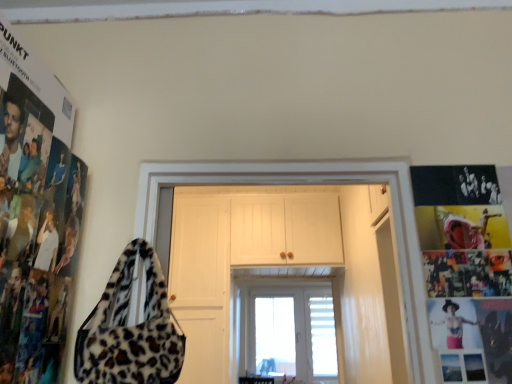
This screenshot has height=384, width=512. Describe the element at coordinates (453, 324) in the screenshot. I see `leather-like red pants at lower right` at that location.

Locate an element on the screen. The height and width of the screenshot is (384, 512). white wooden door at center is located at coordinates click(x=307, y=183).

This screenshot has width=512, height=384. Identify the location of black matte poster at right. (466, 270).

Can you confirm if leopard print fabric shoulder bag at left is wider than leather-like red pants at lower right?

Yes, leopard print fabric shoulder bag at left is wider than leather-like red pants at lower right.

Does point (113, 378) lie in front of point (464, 305)?

Yes.

Which is more to the right, leopard print fabric shoulder bag at left or leather-like red pants at lower right?

Positioned to the right is leather-like red pants at lower right.

From a real-world perspective, is transparent glass door at center physically above leopard print fabric shoulder bag at left?

No.

Is transparent glass door at center wider or thinner than leopard print fabric shoulder bag at left?

In the image, transparent glass door at center appears to be wider than leopard print fabric shoulder bag at left.

Is transparent glass door at center far away from leopard print fabric shoulder bag at left?

Yes, transparent glass door at center is far from leopard print fabric shoulder bag at left.

Does point (303, 331) come farther from viewer compared to point (97, 360)?

Yes, it is.

Considering the relative positions of leopard print fabric shoulder bag at left and transparent glass door at center in the image provided, is leopard print fabric shoulder bag at left behind transparent glass door at center?

No, leopard print fabric shoulder bag at left is closer to the camera.

From the image's perspective, is leopard print fabric shoulder bag at left located beneath transparent glass door at center?

No, from the image's perspective, leopard print fabric shoulder bag at left is not beneath transparent glass door at center.

Considering the sizes of leopard print fabric shoulder bag at left and transparent glass door at center in the image, is leopard print fabric shoulder bag at left taller or shorter than transparent glass door at center?

leopard print fabric shoulder bag at left is shorter than transparent glass door at center.

From the picture: Which of these two, leopard print fabric shoulder bag at left or transparent glass door at center, is wider?

Wider between the two is transparent glass door at center.

Between transparent glass door at center and leather-like red pants at lower right, which one has less height?

leather-like red pants at lower right is shorter.

Locate an element on the screen. The height and width of the screenshot is (384, 512). window behind the leather-like red pants at lower right is located at coordinates (286, 330).

Is transparent glass door at center surrounding leather-like red pants at lower right?

No, leather-like red pants at lower right is not surrounded by transparent glass door at center.

From the image's perspective, which one is positioned higher, transparent glass door at center or leather-like red pants at lower right?

leather-like red pants at lower right is shown above in the image.

Are transparent glass door at center and black matte poster at right located far from each other?

transparent glass door at center is positioned a significant distance from black matte poster at right.

From the image's perspective, which one is positioned higher, transparent glass door at center or black matte poster at right?

From the image's view, black matte poster at right is above.

Does transparent glass door at center come behind black matte poster at right?

Yes, transparent glass door at center is behind black matte poster at right.

Is leather-like red pants at lower right positioned with its back to leopard print fabric shoulder bag at left?

That's not correct — leather-like red pants at lower right is not looking away from leopard print fabric shoulder bag at left.

Which object is more forward, leather-like red pants at lower right or leopard print fabric shoulder bag at left?

leopard print fabric shoulder bag at left is in front.

From a real-world perspective, relative to white wooden door at center, is leopard print fabric shoulder bag at left vertically above or below?

leopard print fabric shoulder bag at left is situated lower than white wooden door at center in the real world.

From the image's perspective, is leopard print fabric shoulder bag at left located above or below white wooden door at center?

Based on their image positions, leopard print fabric shoulder bag at left is located above white wooden door at center.

Is leopard print fabric shoulder bag at left facing towards white wooden door at center?

No.

Considering the points (156, 320) and (402, 290), which point is behind, point (156, 320) or point (402, 290)?

The point (402, 290) is behind.

Locate an element on the screen. This screenshot has width=512, height=384. person on the right side of leopard print fabric shoulder bag at left is located at coordinates (453, 324).

This screenshot has width=512, height=384. Find the location of `shoulder bag on the left side of transparent glass door at center`. shoulder bag on the left side of transparent glass door at center is located at coordinates (130, 329).

Estimate the real-world distances between objects in this image. Which object is closer to leopard print fabric shoulder bag at left, black matte poster at right or white wooden door at center?

white wooden door at center lies closer to leopard print fabric shoulder bag at left than the other object.

Looking at the image, which one is located closer to white wooden door at center, leather-like red pants at lower right or transparent glass door at center?

Among the two, leather-like red pants at lower right is located nearer to white wooden door at center.

Considering their positions, is leopard print fabric shoulder bag at left positioned closer to leather-like red pants at lower right than transparent glass door at center?

leopard print fabric shoulder bag at left is closer to leather-like red pants at lower right.

Looking at the image, which one is located closer to leopard print fabric shoulder bag at left, leather-like red pants at lower right or black matte poster at right?

The object closer to leopard print fabric shoulder bag at left is leather-like red pants at lower right.

Looking at the image, which one is located closer to leather-like red pants at lower right, white wooden door at center or transparent glass door at center?

The object closer to leather-like red pants at lower right is white wooden door at center.

From the image, which object appears to be farther from leopard print fabric shoulder bag at left, white wooden door at center or transparent glass door at center?

Among the two, transparent glass door at center is located further to leopard print fabric shoulder bag at left.

Estimate the real-world distances between objects in this image. Which object is further from transparent glass door at center, leather-like red pants at lower right or leopard print fabric shoulder bag at left?

leather-like red pants at lower right is further to transparent glass door at center.

From the image, which object appears to be farther from white wooden door at center, black matte poster at right or transparent glass door at center?

transparent glass door at center is positioned further to the anchor white wooden door at center.

This screenshot has height=384, width=512. Identify the location of door positioned between black matte poster at right and transparent glass door at center from near to far. (307, 183).

Find the location of `door between leopard print fabric shoulder bag at left and transparent glass door at center in the front-back direction`. door between leopard print fabric shoulder bag at left and transparent glass door at center in the front-back direction is located at coordinates (307, 183).

The height and width of the screenshot is (384, 512). What are the coordinates of `poster page between leather-like red pants at lower right and transparent glass door at center in the front-back direction` in the screenshot? It's located at (466, 270).

In order to click on person between leopard print fabric shoulder bag at left and white wooden door at center in the front-back direction in this screenshot , I will do `click(453, 324)`.